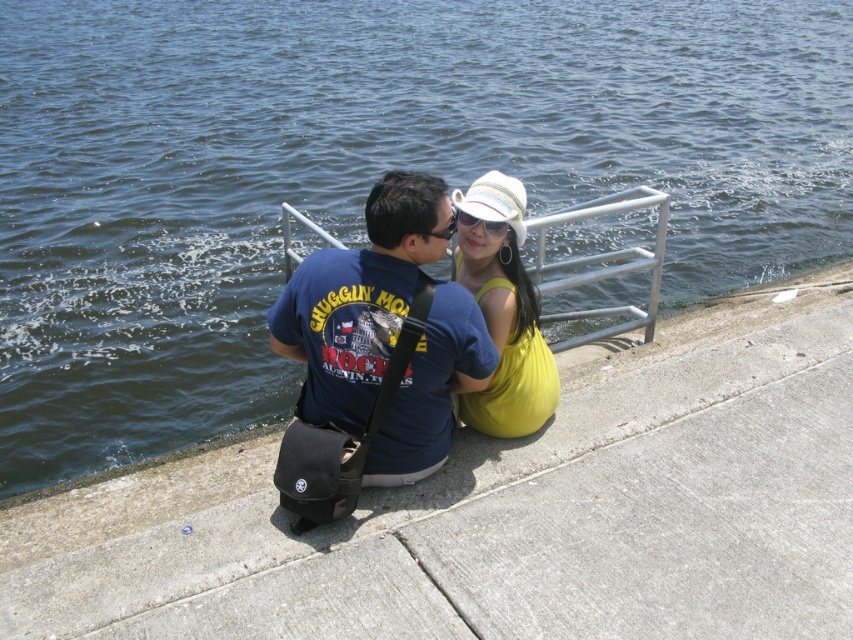
You are a photographer trying to capture a closeup of the white woven baseball hat at center and sunglasses at center. Since both are at the center, which one is closer to the camera?

The white woven baseball hat at center is positioned over sunglasses at center, so it is closer to the camera.